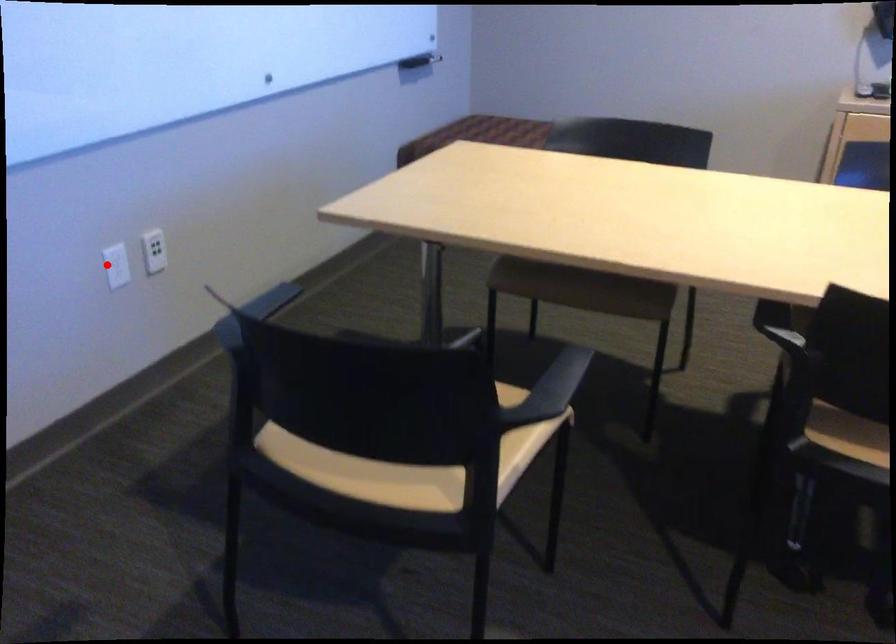
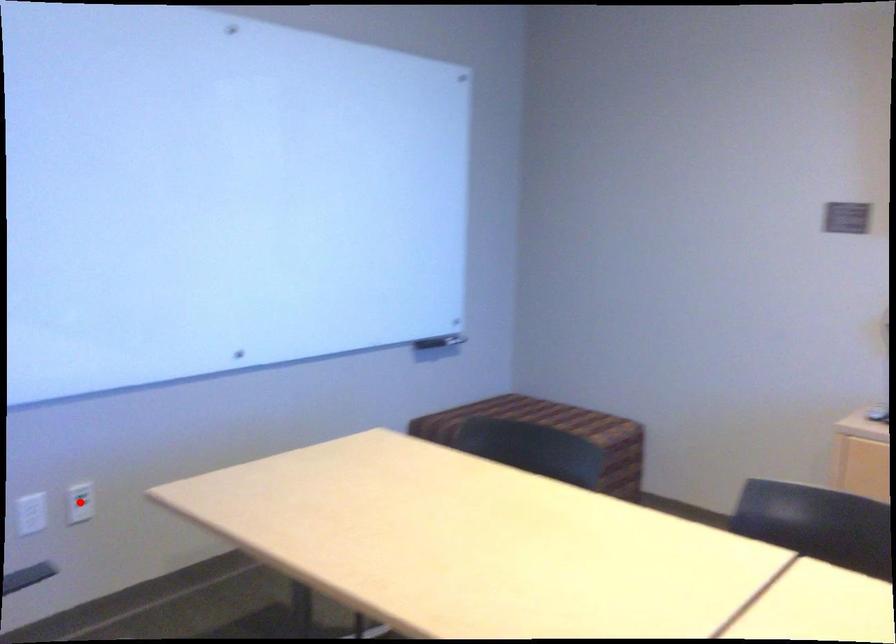
I am providing you with two images of the same scene from different viewpoints. A red point is marked on the first image and another point is marked on the second image. Does the point marked in image1 correspond to the same location as the one in image2?

No